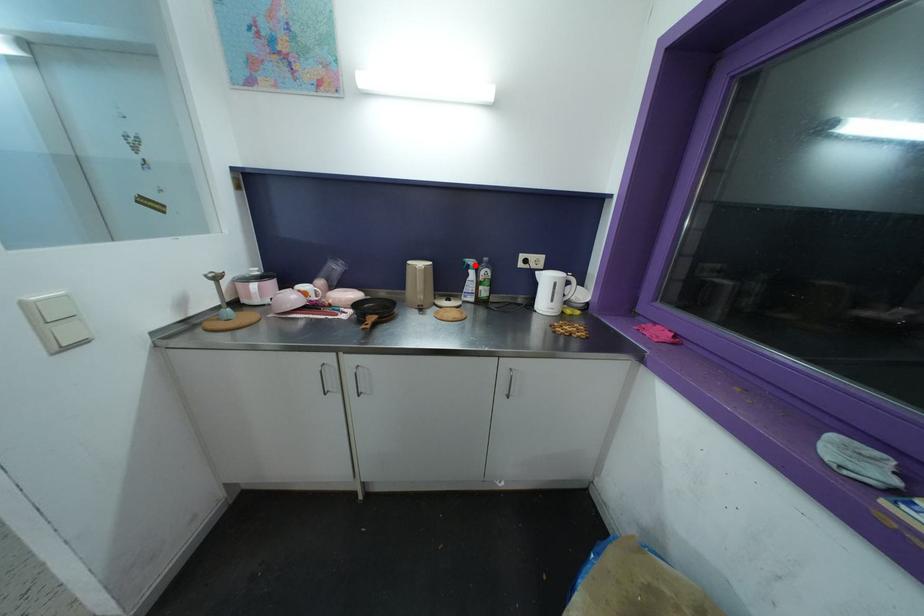
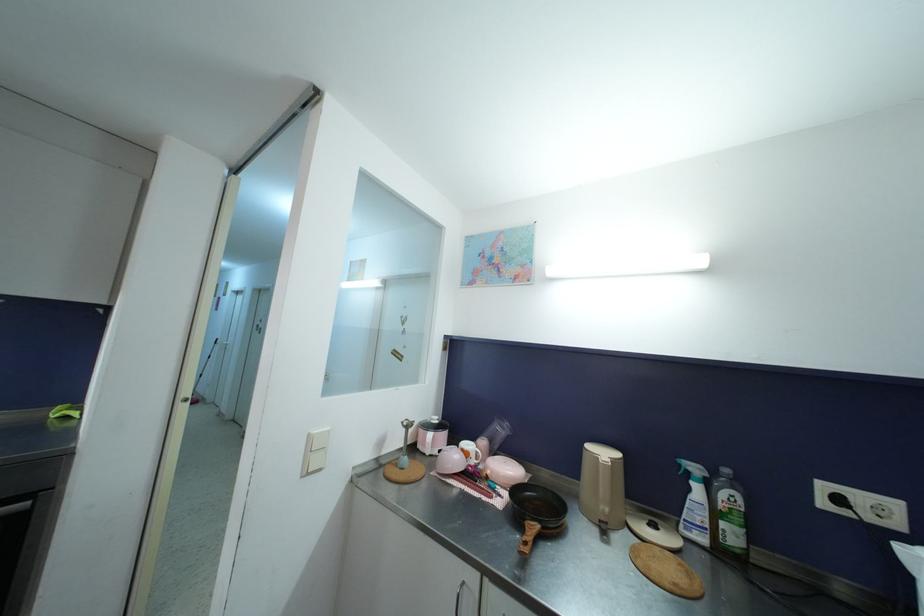
Where in the second image is the point corresponding to the highlighted location from the first image?

(699, 472)